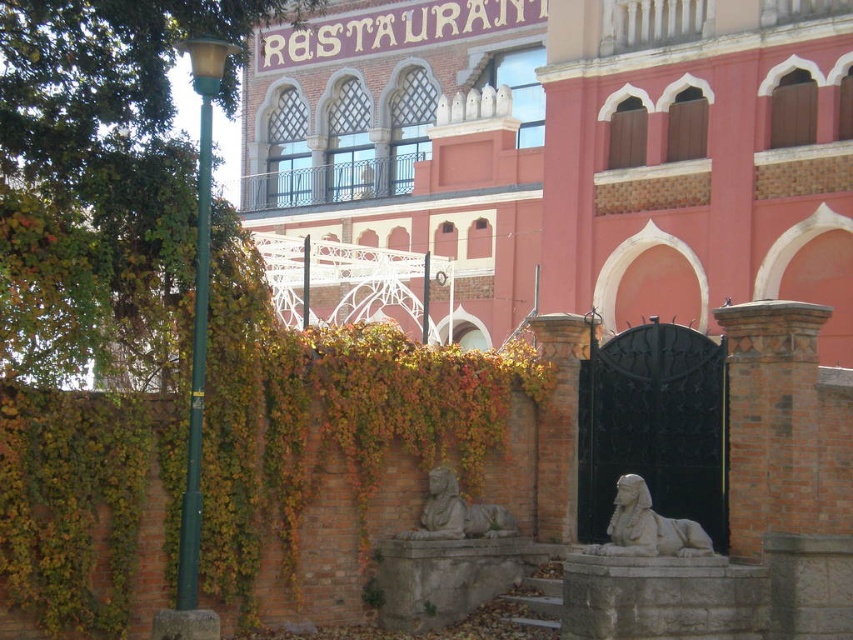
You are standing in front of the building and want to take a photo that includes both the point at coordinates point (578, 280) and point (460, 516). Since you want to ensure both points are in focus, which point should you focus on to capture both effectively?

You should focus on point (578, 280) because it is closer to the camera than point (460, 516). Focusing on the closer point ensures the farther point will also be in focus due to depth of field.

You are a visitor approaching the entrance of the building. You notice two sphinx statues at the center. Which one is bigger between the smooth stone sphinxes at center and the gray stone sphinx at center?

The smooth stone sphinxes at center is larger in size than the gray stone sphinx at center.

You are a visitor approaching the entrance of the building. You notice two sphinx statues. Which one is taller, the smooth stone sphinxes at center or the white stone sphinx at lower right?

The smooth stone sphinxes at center is much taller than the white stone sphinx at lower right.